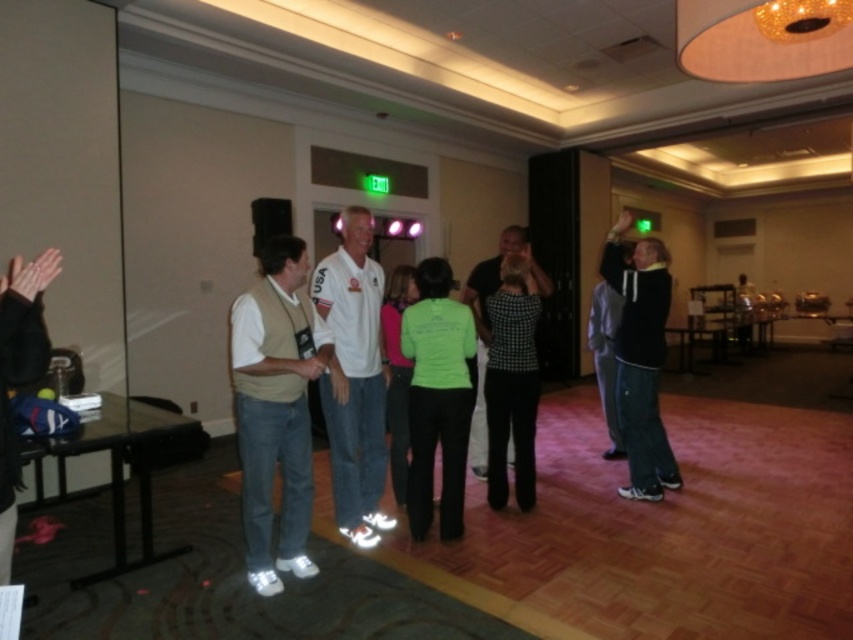
Question: Is dark gray hoodie at right to the right of black textured shirt at center from the viewer's perspective?

Choices:
 (A) yes
 (B) no

Answer: (A)

Question: Which is farther from the black leather jacket at left?

Choices:
 (A) black textured shirt at center
 (B) dark gray hoodie at right
 (C) white matte shirt at center
 (D) light brown suede vest at center

Answer: (B)

Question: Is light brown suede vest at center bigger than black textured shirt at center?

Choices:
 (A) no
 (B) yes

Answer: (A)

Question: Considering the real-world distances, which object is closest to the white matte shirt at center?

Choices:
 (A) dark gray hoodie at right
 (B) black leather jacket at left
 (C) light brown suede vest at center
 (D) black textured shirt at center

Answer: (C)

Question: Does black leather jacket at left appear on the left side of black textured shirt at center?

Choices:
 (A) no
 (B) yes

Answer: (B)

Question: Which of the following is the closest to the observer?

Choices:
 (A) (485, 442)
 (B) (19, 353)
 (C) (618, 416)

Answer: (B)